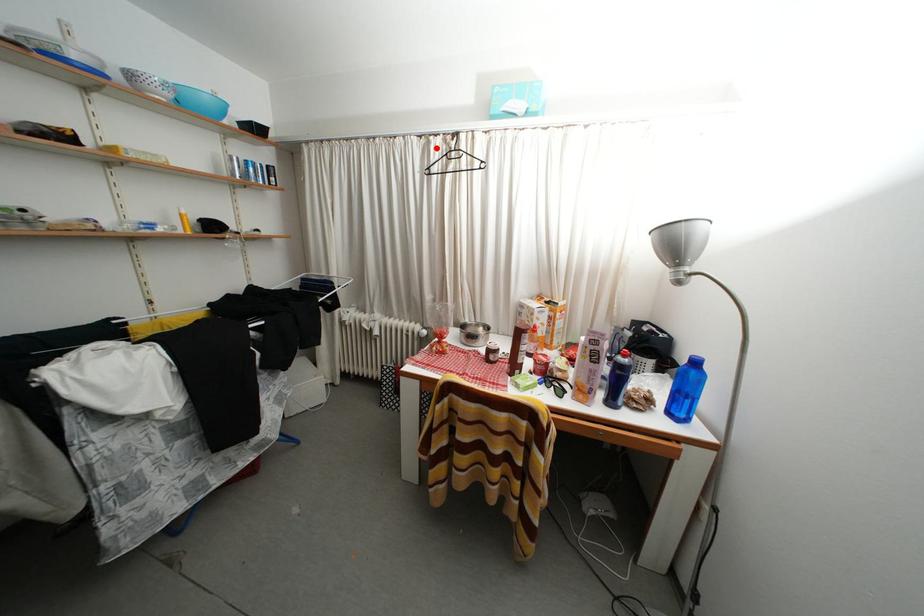
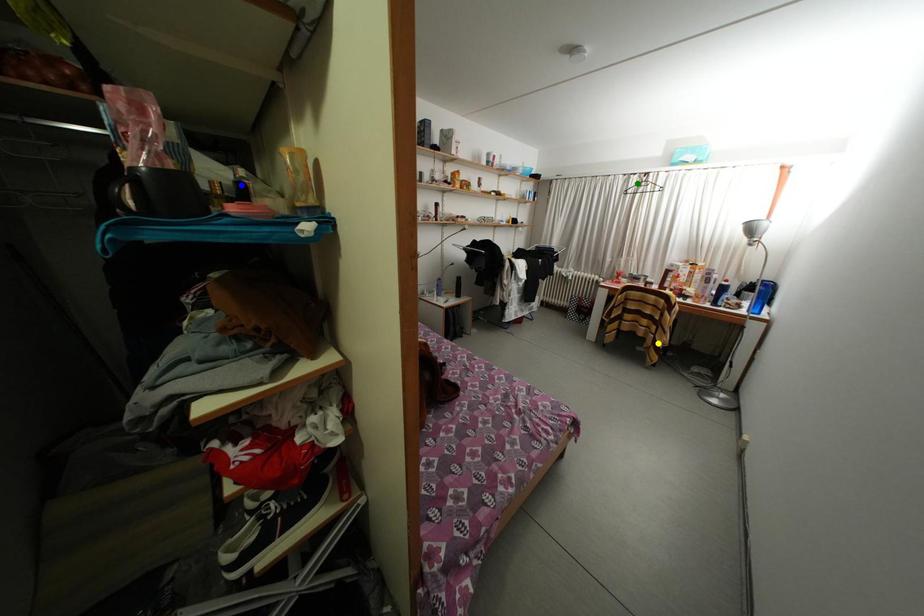
Question: I am providing you with two images of the same scene from different viewpoints. A red point is marked on the first image. You are given multiple points on the second image. Can you choose the point in image 2 that corresponds to the point in image 1?

Choices:
 (A) blue point
 (B) yellow point
 (C) green point

Answer: (C)